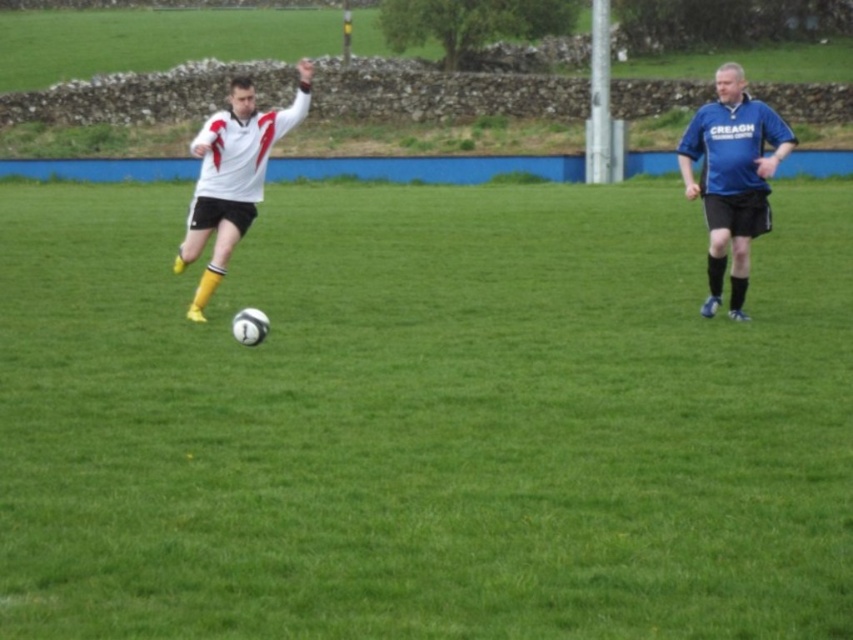
You are a soccer coach analyzing the play. You notice the blue jersey at right and the white matte jersey at center. Which player is closer to the ground?

The blue jersey at right is positioned under white matte jersey at center, meaning the blue jersey at right is closer to the ground.

You are a soccer coach analyzing the match. The field has a goal post located at coordinates 0.655, 0.498. Where is the white matte soccer ball at center relative to the goal post?

The white matte soccer ball at center is located exactly at the goal post coordinates [424,419], meaning it is positioned right at the goal post.

You are a soccer coach analyzing the game from the sidelines. You notice two points marked on the field at coordinates point (727, 612) and point (228, 177). Which point is nearer to your vantage point as the coach?

Point (727, 612) is closer to the camera than point (228, 177), so the point (727, 612) is nearer to your vantage point as the coach.